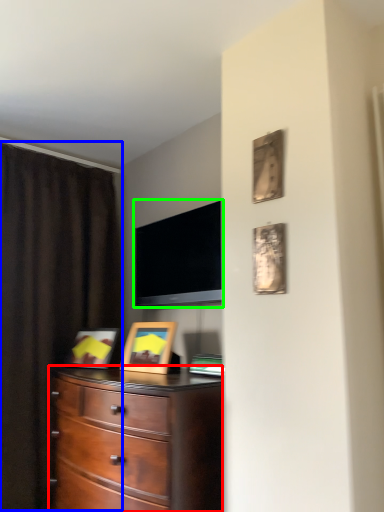
Question: Based on their relative distances, which object is nearer to chest of drawers (highlighted by a red box)? Choose from curtain (highlighted by a blue box) and television (highlighted by a green box).

Choices:
 (A) curtain
 (B) television

Answer: (B)